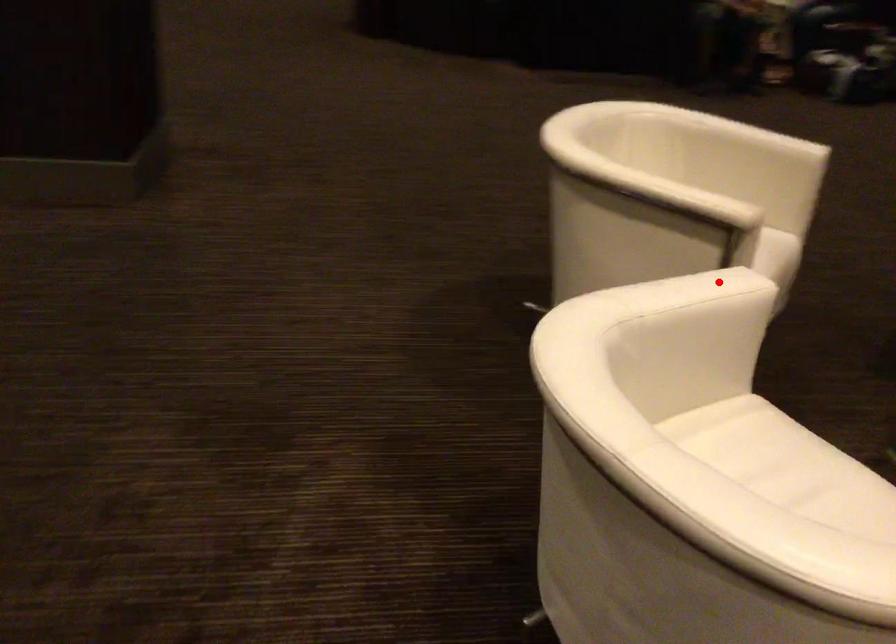
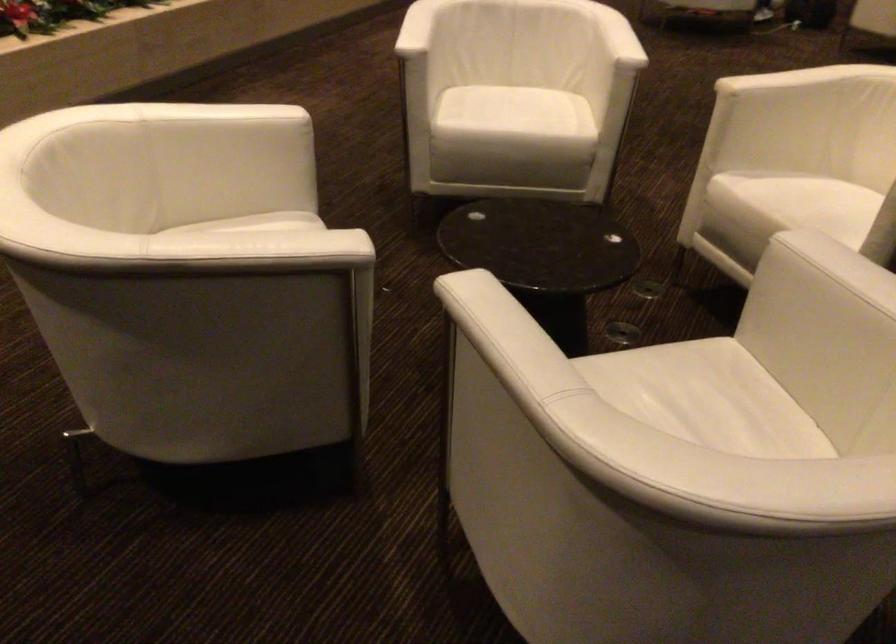
Question: I am providing you with two images of the same scene from different viewpoints. Given a red point in image1, look at the same physical point in image2. Is it:

Choices:
 (A) Closer to the viewpoint
 (B) Farther from the viewpoint

Answer: (B)